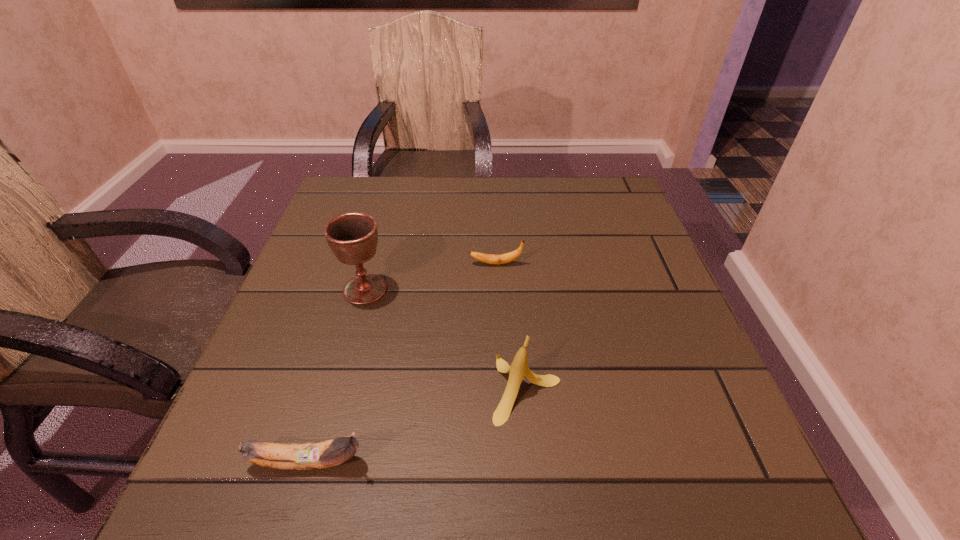
Find the location of a particular element. The height and width of the screenshot is (540, 960). vacant space at the right edge of the desktop is located at coordinates (614, 299).

You are a GUI agent. You are given a task and a screenshot of the screen. Output one action in this format:
    pyautogui.click(x=<x>, y=<y>)
    Task: Click on the vacant space at the far left corner
    This screenshot has height=540, width=960.
    Given the screenshot: What is the action you would take?
    pyautogui.click(x=335, y=215)

At what (x,y) coordinates should I click in order to perform the action: click on vacant region at the near left corner of the desktop. Please return your answer as a coordinate pair (x, y). The image size is (960, 540). Looking at the image, I should click on (310, 483).

At what (x,y) coordinates should I click in order to perform the action: click on vacant space at the far right corner. Please return your answer as a coordinate pair (x, y). The height and width of the screenshot is (540, 960). Looking at the image, I should click on (614, 202).

The width and height of the screenshot is (960, 540). I want to click on free spot between the nearest object and the second farthest banana, so click(x=418, y=425).

This screenshot has height=540, width=960. Find the location of `vacant area between the nearest banana and the second farthest banana`. vacant area between the nearest banana and the second farthest banana is located at coordinates (418, 425).

Find the location of `blank region between the farthest banana and the chalice`. blank region between the farthest banana and the chalice is located at coordinates (430, 276).

You are a GUI agent. You are given a task and a screenshot of the screen. Output one action in this format:
    pyautogui.click(x=<x>, y=<y>)
    Task: Click on the vacant area between the shortest object and the second nearest banana
    The width and height of the screenshot is (960, 540).
    Given the screenshot: What is the action you would take?
    pyautogui.click(x=512, y=326)

Find the location of a particular element. The width and height of the screenshot is (960, 540). free space between the shortest object and the second farthest object is located at coordinates (430, 276).

This screenshot has height=540, width=960. In order to click on free spot between the tallest object and the farthest object in this screenshot , I will do `click(430, 276)`.